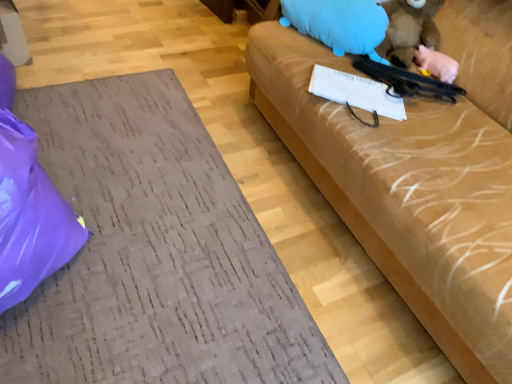
Question: From the image's perspective, is fuzzy brown animal at upper right, positioned as the 2th animal in left-to-right order, under blue plush toy at upper right, the first animal viewed from the left?

Choices:
 (A) yes
 (B) no

Answer: (A)

Question: Does fuzzy brown animal at upper right, the second animal positioned from the right, have a smaller size compared to blue plush toy at upper right, the first animal viewed from the left?

Choices:
 (A) no
 (B) yes

Answer: (B)

Question: Can you confirm if fuzzy brown animal at upper right, positioned as the 2th animal in left-to-right order, is positioned to the left of blue plush toy at upper right, placed as the third animal when sorted from right to left?

Choices:
 (A) no
 (B) yes

Answer: (A)

Question: Is blue plush toy at upper right, the first animal viewed from the left, at the back of fuzzy brown animal at upper right, the second animal positioned from the right?

Choices:
 (A) yes
 (B) no

Answer: (B)

Question: Considering the relative sizes of fuzzy brown animal at upper right, positioned as the 2th animal in left-to-right order, and blue plush toy at upper right, placed as the third animal when sorted from right to left, in the image provided, is fuzzy brown animal at upper right, positioned as the 2th animal in left-to-right order, thinner than blue plush toy at upper right, placed as the third animal when sorted from right to left,?

Choices:
 (A) no
 (B) yes

Answer: (A)

Question: From a real-world perspective, is blue plush toy at upper right, the first animal viewed from the left, positioned above or below pink rubber pig at upper right, which appears as the 1th animal when viewed from the right?

Choices:
 (A) below
 (B) above

Answer: (B)

Question: In terms of size, does blue plush toy at upper right, placed as the third animal when sorted from right to left, appear bigger or smaller than pink rubber pig at upper right, which appears as the 1th animal when viewed from the right?

Choices:
 (A) small
 (B) big

Answer: (B)

Question: In the image, is blue plush toy at upper right, the first animal viewed from the left, on the left side or the right side of pink rubber pig at upper right, which appears as the 1th animal when viewed from the right?

Choices:
 (A) left
 (B) right

Answer: (A)

Question: Is blue plush toy at upper right, placed as the third animal when sorted from right to left, wider or thinner than pink rubber pig at upper right, arranged as the 3th animal when viewed from the left?

Choices:
 (A) wide
 (B) thin

Answer: (A)

Question: From a real-world perspective, is matte brown couch at right physically located above or below purple plastic bag at lower left?

Choices:
 (A) below
 (B) above

Answer: (A)

Question: In the image, is matte brown couch at right positioned in front of or behind purple plastic bag at lower left?

Choices:
 (A) behind
 (B) front

Answer: (A)

Question: Based on their sizes in the image, would you say matte brown couch at right is bigger or smaller than purple plastic bag at lower left?

Choices:
 (A) big
 (B) small

Answer: (B)

Question: Is point (112, 319) closer or farther from the camera than point (1, 286)?

Choices:
 (A) farther
 (B) closer

Answer: (A)

Question: Considering the positions of blue plush toy at upper right, placed as the third animal when sorted from right to left, and purple plastic bag at lower left in the image, is blue plush toy at upper right, placed as the third animal when sorted from right to left, bigger or smaller than purple plastic bag at lower left?

Choices:
 (A) small
 (B) big

Answer: (A)

Question: Is point (283, 23) positioned closer to the camera than point (7, 216)?

Choices:
 (A) closer
 (B) farther

Answer: (B)